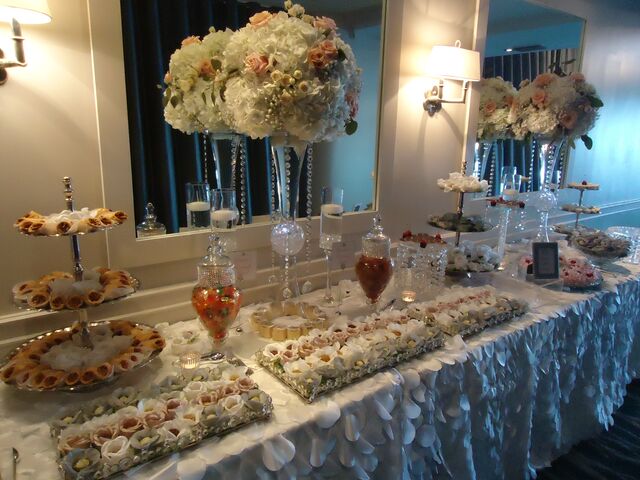
Where is `table`? Image resolution: width=640 pixels, height=480 pixels. table is located at coordinates (292, 415).